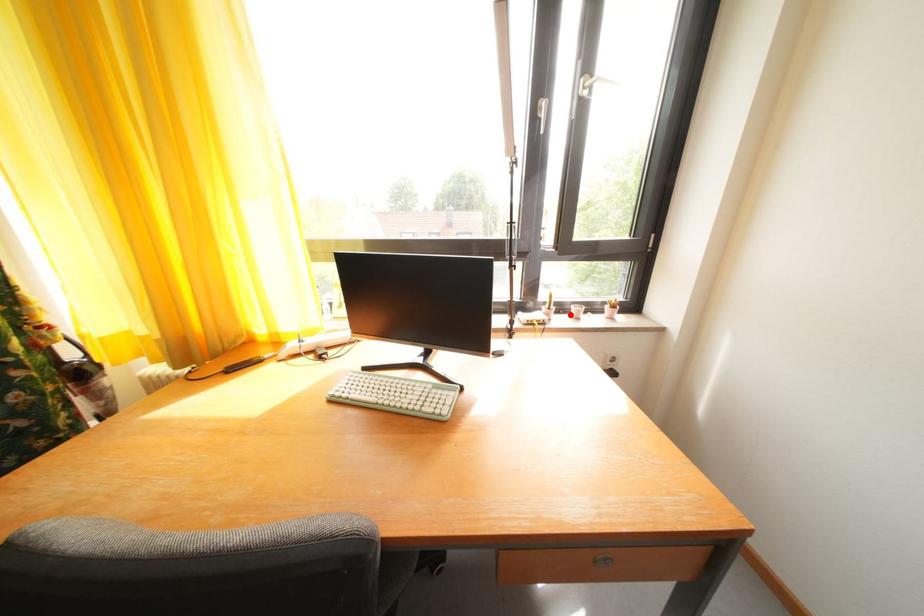
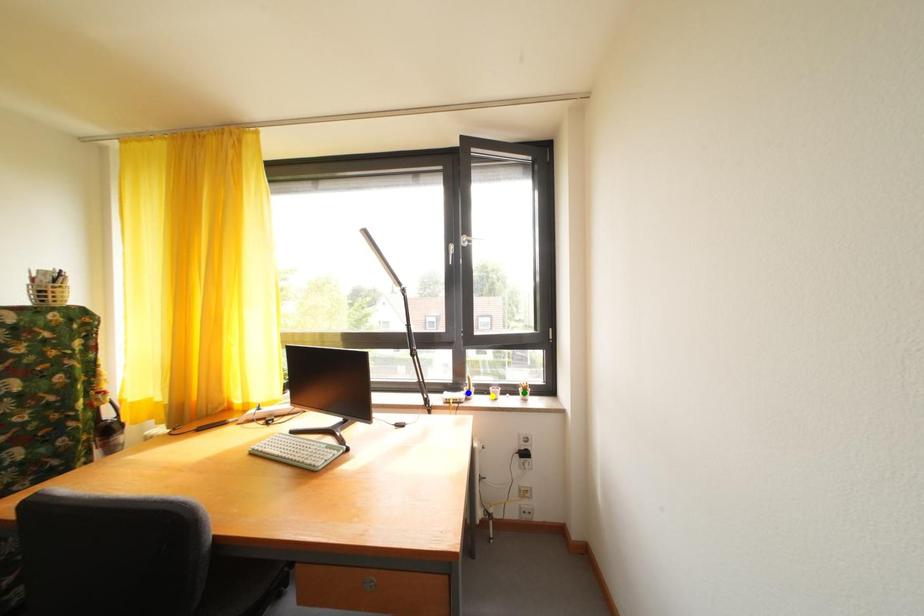
Question: I am providing you with two images of the same scene from different viewpoints. A red point is marked on the first image. You are given multiple points on the second image. Can you choose the point in image 2 that corresponds to the point in image 1?

Choices:
 (A) green point
 (B) yellow point
 (C) blue point

Answer: (B)